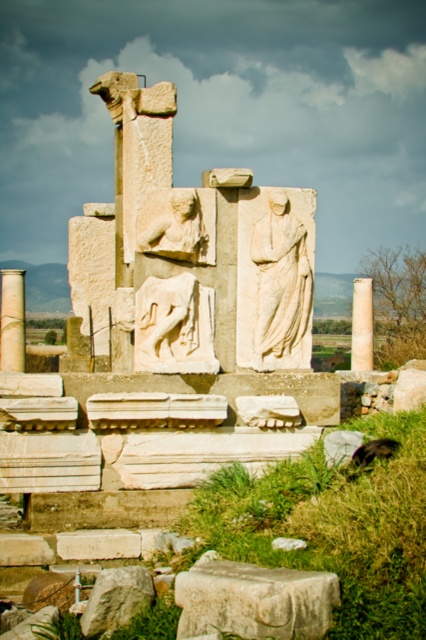
Between white marble statue at center and white marble column at center, which one is positioned higher?

white marble statue at center is higher up.

Is white marble statue at center to the left of white marble column at center from the viewer's perspective?

Indeed, white marble statue at center is positioned on the left side of white marble column at center.

Is point (305, 332) positioned behind point (356, 337)?

No.

Locate an element on the screen. white marble statue at center is located at coordinates (276, 276).

Can you confirm if matte stone lion at center is wider than white marble pillar at left?

No, matte stone lion at center is not wider than white marble pillar at left.

Is matte stone lion at center bigger than white marble pillar at left?

Incorrect, matte stone lion at center is not larger than white marble pillar at left.

Which is in front, point (175, 208) or point (2, 339)?

Positioned in front is point (175, 208).

Locate an element on the screen. The width and height of the screenshot is (426, 640). matte stone lion at center is located at coordinates (178, 225).

What do you see at coordinates (11, 321) in the screenshot? I see `white marble pillar at left` at bounding box center [11, 321].

Is white marble pillar at left positioned behind white marble column at center?

No, it is not.

Find the location of a particular element. The width and height of the screenshot is (426, 640). white marble pillar at left is located at coordinates (11, 321).